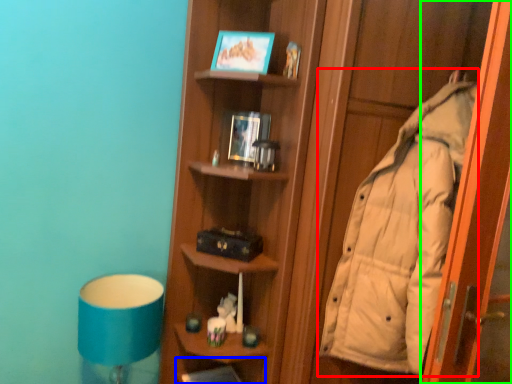
Question: Based on their relative distances, which object is nearer to coat (highlighted by a red box)? Choose from shelf (highlighted by a blue box) and screen door (highlighted by a green box).

Choices:
 (A) shelf
 (B) screen door

Answer: (B)